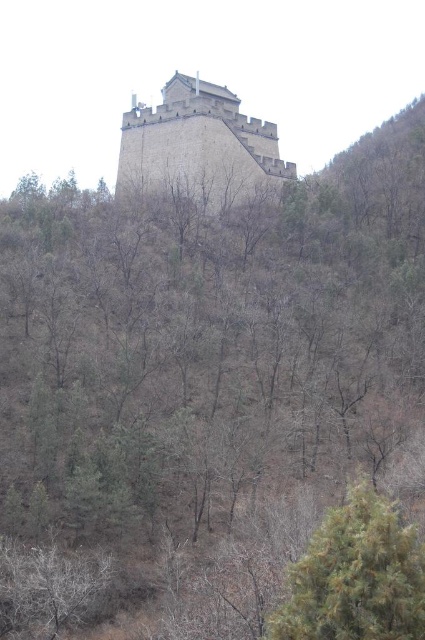
Question: Which of the following is the farthest from the observer?

Choices:
 (A) (184, 129)
 (B) (348, 500)

Answer: (A)

Question: Is green textured tree at lower right positioned before gray stone tower at center?

Choices:
 (A) yes
 (B) no

Answer: (A)

Question: Is green textured tree at lower right to the left of gray stone tower at center from the viewer's perspective?

Choices:
 (A) no
 (B) yes

Answer: (A)

Question: Does green textured tree at lower right appear on the right side of gray stone tower at center?

Choices:
 (A) yes
 (B) no

Answer: (A)

Question: Which point is farther to the camera?

Choices:
 (A) (200, 109)
 (B) (357, 525)

Answer: (A)